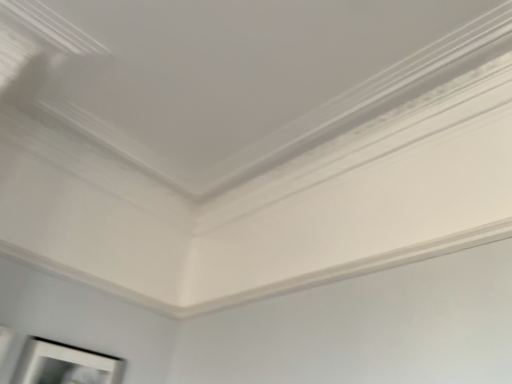
Measure the distance between point (36, 379) and camera.

Point (36, 379) and camera are 5.42 feet apart from each other.

Find the location of a particular element. This screenshot has height=384, width=512. white glossy picture frame at lower left is located at coordinates (66, 364).

The width and height of the screenshot is (512, 384). What do you see at coordinates (66, 364) in the screenshot?
I see `white glossy picture frame at lower left` at bounding box center [66, 364].

Locate an element on the screen. The width and height of the screenshot is (512, 384). white glossy picture frame at lower left is located at coordinates 66,364.